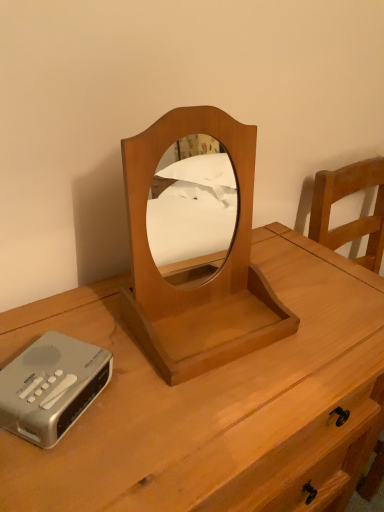
Find the location of `wooden mirror at center`. wooden mirror at center is located at coordinates (196, 276).

Describe the element at coordinates (196, 276) in the screenshot. I see `wooden mirror at center` at that location.

Measure the distance between silver metallic cassette at lower left and camera.

50.41 centimeters.

Where is `light brown wood nightstand at center`? Image resolution: width=384 pixels, height=512 pixels. light brown wood nightstand at center is located at coordinates (215, 402).

Where is `wooden mirror at center`? wooden mirror at center is located at coordinates (196, 276).

Can you confirm if wooden mirror at center is smaller than light brown wood nightstand at center?

Yes.

From a real-world perspective, relative to light brown wood nightstand at center, is wooden mirror at center vertically above or below?

wooden mirror at center is situated higher than light brown wood nightstand at center in the real world.

How different are the orientations of wooden mirror at center and light brown wood nightstand at center in degrees?

There is a 4.14-degree angle between the facing directions of wooden mirror at center and light brown wood nightstand at center.

In terms of height, does wooden mirror at center look taller or shorter compared to light brown wood nightstand at center?

Clearly, wooden mirror at center is shorter compared to light brown wood nightstand at center.

Which is more to the right, silver metallic cassette at lower left or wooden mirror at center?

Positioned to the right is wooden mirror at center.

Can you confirm if silver metallic cassette at lower left is shorter than wooden mirror at center?

Yes, silver metallic cassette at lower left is shorter than wooden mirror at center.

The image size is (384, 512). Find the location of `cassette on the left of the wooden mirror at center`. cassette on the left of the wooden mirror at center is located at coordinates tap(51, 387).

From a real-world perspective, is silver metallic cassette at lower left physically above wooden mirror at center?

No.

How far apart are light brown wood nightstand at center and silver metallic cassette at lower left?

A distance of 11.37 inches exists between light brown wood nightstand at center and silver metallic cassette at lower left.

In the image, there is a silver metallic cassette at lower left. Where is `nightstand below it (from the image's perspective)`? nightstand below it (from the image's perspective) is located at coordinates (215, 402).

From a real-world perspective, is light brown wood nightstand at center above or below silver metallic cassette at lower left?

Clearly, from a real-world perspective, light brown wood nightstand at center is below silver metallic cassette at lower left.

From the image's perspective, does light brown wood nightstand at center appear higher than silver metallic cassette at lower left?

No, from the image's perspective, light brown wood nightstand at center is not on top of silver metallic cassette at lower left.

Is wooden mirror at center wider or thinner than silver metallic cassette at lower left?

In the image, wooden mirror at center appears to be wider than silver metallic cassette at lower left.

From a real-world perspective, is wooden mirror at center physically above silver metallic cassette at lower left?

Yes, from a real-world perspective, wooden mirror at center is over silver metallic cassette at lower left

In the scene shown: Relative to silver metallic cassette at lower left, is wooden mirror at center in front or behind?

wooden mirror at center is positioned closer to the viewer than silver metallic cassette at lower left.

Is wooden mirror at center positioned with its back to silver metallic cassette at lower left?

No, silver metallic cassette at lower left is not at the back of wooden mirror at center.

From a real-world perspective, is silver metallic cassette at lower left positioned over light brown wood nightstand at center based on gravity?

Yes, from a real-world perspective, silver metallic cassette at lower left is over light brown wood nightstand at center

In the scene shown: Which object is positioned more to the right, silver metallic cassette at lower left or light brown wood nightstand at center?

From the viewer's perspective, light brown wood nightstand at center appears more on the right side.

Does point (8, 408) come farther from viewer compared to point (271, 356)?

No, it is in front of (271, 356).

Does silver metallic cassette at lower left turn towards light brown wood nightstand at center?

Yes, silver metallic cassette at lower left is aimed at light brown wood nightstand at center.

Identify the location of mirror lying behind the light brown wood nightstand at center. (196, 276).

Is light brown wood nightstand at center positioned in front of wooden mirror at center?

Yes, light brown wood nightstand at center is in front of wooden mirror at center.

How far apart are light brown wood nightstand at center and wooden mirror at center?

The distance of light brown wood nightstand at center from wooden mirror at center is 6.22 inches.

Identify the location of nightstand in front of the wooden mirror at center. (215, 402).

I want to click on cassette lying behind the wooden mirror at center, so click(x=51, y=387).

Looking at the image, which one is located closer to light brown wood nightstand at center, silver metallic cassette at lower left or wooden mirror at center?

The object closer to light brown wood nightstand at center is wooden mirror at center.

Looking at this image, estimate the real-world distances between objects in this image. Which object is closer to wooden mirror at center, light brown wood nightstand at center or silver metallic cassette at lower left?

light brown wood nightstand at center is positioned closer to the anchor wooden mirror at center.

Considering their positions, is silver metallic cassette at lower left positioned further to wooden mirror at center than light brown wood nightstand at center?

silver metallic cassette at lower left is positioned further to the anchor wooden mirror at center.

Based on their spatial positions, is wooden mirror at center or silver metallic cassette at lower left further from light brown wood nightstand at center?

silver metallic cassette at lower left is positioned further to the anchor light brown wood nightstand at center.

Based on their spatial positions, is light brown wood nightstand at center or wooden mirror at center further from silver metallic cassette at lower left?

light brown wood nightstand at center lies further to silver metallic cassette at lower left than the other object.

Looking at the image, which one is located further to silver metallic cassette at lower left, wooden mirror at center or light brown wood nightstand at center?

light brown wood nightstand at center lies further to silver metallic cassette at lower left than the other object.

The height and width of the screenshot is (512, 384). I want to click on cassette between wooden mirror at center and light brown wood nightstand at center in the up-down direction, so click(x=51, y=387).